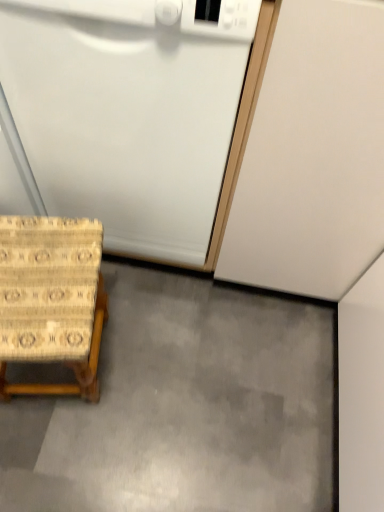
Locate an element on the screen. Image resolution: width=384 pixels, height=512 pixels. beige woven stool at lower left is located at coordinates (51, 298).

Measure the distance between point (78,268) and camera.

Point (78,268) and camera are 33.35 inches apart from each other.

The width and height of the screenshot is (384, 512). Find the location of `gray smooth concrete at lower center`. gray smooth concrete at lower center is located at coordinates [x=185, y=406].

Does gray smooth concrete at lower center have a lesser width compared to white matte dishwasher at lower left?

In fact, gray smooth concrete at lower center might be wider than white matte dishwasher at lower left.

From a real-world perspective, is gray smooth concrete at lower center physically located above or below white matte dishwasher at lower left?

From a real-world perspective, gray smooth concrete at lower center is physically below white matte dishwasher at lower left.

Is gray smooth concrete at lower center with white matte dishwasher at lower left?

There is a gap between gray smooth concrete at lower center and white matte dishwasher at lower left.

Does point (162, 391) appear closer or farther from the camera than point (72, 2)?

Point (162, 391) appears to be farther away from the viewer than point (72, 2).

Considering the relative positions of gray smooth concrete at lower center and beige woven stool at lower left in the image provided, is gray smooth concrete at lower center to the right of beige woven stool at lower left from the viewer's perspective?

Indeed, gray smooth concrete at lower center is positioned on the right side of beige woven stool at lower left.

Is gray smooth concrete at lower center facing towards beige woven stool at lower left?

No, gray smooth concrete at lower center is not oriented towards beige woven stool at lower left.

Is gray smooth concrete at lower center in front of or behind beige woven stool at lower left in the image?

Visually, gray smooth concrete at lower center is located behind beige woven stool at lower left.

From a real-world perspective, who is located lower, gray smooth concrete at lower center or beige woven stool at lower left?

From a 3D spatial view, gray smooth concrete at lower center is below.

Is white matte dishwasher at lower left wider or thinner than beige woven stool at lower left?

Considering their sizes, white matte dishwasher at lower left looks broader than beige woven stool at lower left.

Which object is positioned more to the left, white matte dishwasher at lower left or beige woven stool at lower left?

Positioned to the left is beige woven stool at lower left.

Considering the sizes of objects white matte dishwasher at lower left and beige woven stool at lower left in the image provided, who is smaller, white matte dishwasher at lower left or beige woven stool at lower left?

Smaller between the two is beige woven stool at lower left.

Locate an element on the screen. The width and height of the screenshot is (384, 512). furniture on the left of white matte dishwasher at lower left is located at coordinates (51, 298).

Can you confirm if beige woven stool at lower left is positioned to the right of white matte dishwasher at lower left?

In fact, beige woven stool at lower left is to the left of white matte dishwasher at lower left.

From a real-world perspective, is beige woven stool at lower left beneath white matte dishwasher at lower left?

Indeed, from a real-world perspective, beige woven stool at lower left is positioned beneath white matte dishwasher at lower left.

Can you confirm if beige woven stool at lower left is thinner than white matte dishwasher at lower left?

Yes.

Can you tell me how much beige woven stool at lower left and white matte dishwasher at lower left differ in facing direction?

The angle between the facing direction of beige woven stool at lower left and the facing direction of white matte dishwasher at lower left is 10 degrees.

Which is closer to the camera, (48, 194) or (203, 485)?

Point (48, 194) is closer to the camera than point (203, 485).

Is white matte dishwasher at lower left to the right of gray smooth concrete at lower center from the viewer's perspective?

No, white matte dishwasher at lower left is not to the right of gray smooth concrete at lower center.

From their relative heights in the image, would you say white matte dishwasher at lower left is taller or shorter than gray smooth concrete at lower center?

Considering their sizes, white matte dishwasher at lower left has more height than gray smooth concrete at lower center.

Considering the positions of objects beige woven stool at lower left and gray smooth concrete at lower center in the image provided, who is more to the right, beige woven stool at lower left or gray smooth concrete at lower center?

Positioned to the right is gray smooth concrete at lower center.

Are beige woven stool at lower left and gray smooth concrete at lower center making contact?

There is a gap between beige woven stool at lower left and gray smooth concrete at lower center.

Is beige woven stool at lower left wider than gray smooth concrete at lower center?

No, beige woven stool at lower left is not wider than gray smooth concrete at lower center.

Identify the location of appliance on the left of gray smooth concrete at lower center. The image size is (384, 512). (134, 113).

This screenshot has width=384, height=512. What are the coordinates of `furniture in front of the gray smooth concrete at lower center` in the screenshot? It's located at (51, 298).

Which object lies further to the anchor point beige woven stool at lower left, gray smooth concrete at lower center or white matte dishwasher at lower left?

Among the two, gray smooth concrete at lower center is located further to beige woven stool at lower left.

Which object lies nearer to the anchor point gray smooth concrete at lower center, white matte dishwasher at lower left or beige woven stool at lower left?

beige woven stool at lower left is positioned closer to the anchor gray smooth concrete at lower center.

Estimate the real-world distances between objects in this image. Which object is further from beige woven stool at lower left, white matte dishwasher at lower left or gray smooth concrete at lower center?

The object further to beige woven stool at lower left is gray smooth concrete at lower center.

Considering their positions, is beige woven stool at lower left positioned further to white matte dishwasher at lower left than gray smooth concrete at lower center?

gray smooth concrete at lower center.

Considering their positions, is gray smooth concrete at lower center positioned further to white matte dishwasher at lower left than beige woven stool at lower left?

gray smooth concrete at lower center.

Which object lies nearer to the anchor point gray smooth concrete at lower center, beige woven stool at lower left or white matte dishwasher at lower left?

beige woven stool at lower left lies closer to gray smooth concrete at lower center than the other object.

Identify the location of furniture between white matte dishwasher at lower left and gray smooth concrete at lower center vertically. (51, 298).